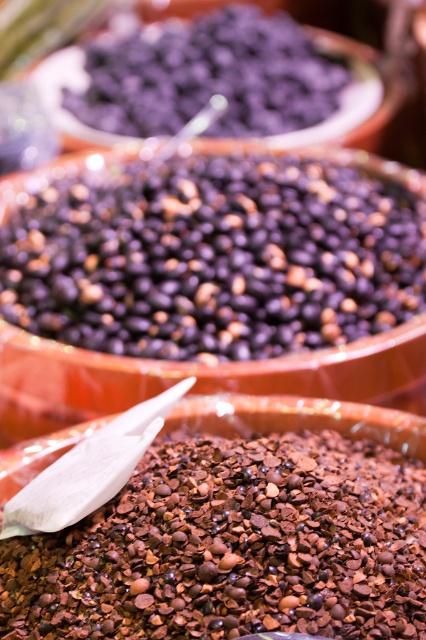
Question: Is dark matte beans at center to the left of dark purple matte beans at upper center from the viewer's perspective?

Choices:
 (A) no
 (B) yes

Answer: (A)

Question: Which point is farther from the camera taking this photo?

Choices:
 (A) (121, 540)
 (B) (163, 72)
 (C) (215, 282)

Answer: (B)

Question: Is dark matte beans at center smaller than brown granular chocolate at center?

Choices:
 (A) yes
 (B) no

Answer: (B)

Question: Which object is the closest to the dark matte beans at center?

Choices:
 (A) brown granular chocolate at center
 (B) dark purple matte beans at upper center

Answer: (A)

Question: Among these points, which one is farthest from the camera?

Choices:
 (A) (351, 573)
 (B) (135, 227)

Answer: (B)

Question: Does brown granular chocolate at center have a lesser width compared to dark purple matte beans at upper center?

Choices:
 (A) yes
 (B) no

Answer: (A)